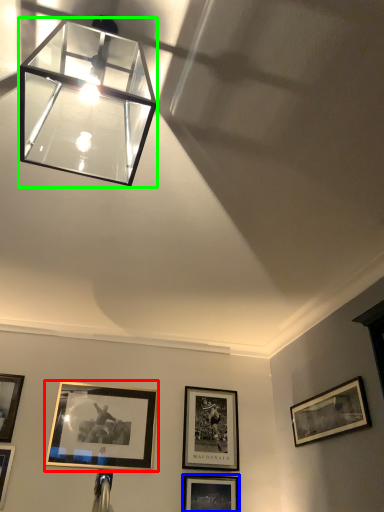
Question: Which is farther away from picture frame (highlighted by a red box)? picture frame (highlighted by a blue box) or lamp (highlighted by a green box)?

Choices:
 (A) picture frame
 (B) lamp

Answer: (B)